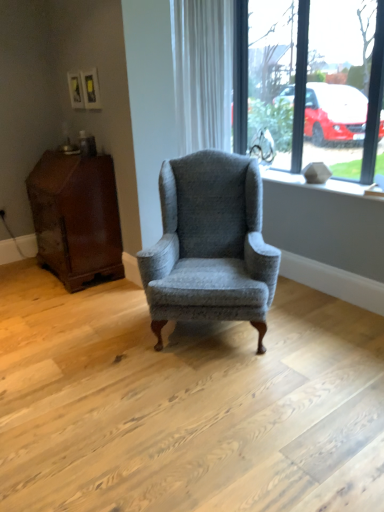
Question: Is clear glass window at upper right closer to the viewer compared to textured gray wingback chair at center?

Choices:
 (A) yes
 (B) no

Answer: (B)

Question: From the image's perspective, is clear glass window at upper right over textured gray wingback chair at center?

Choices:
 (A) yes
 (B) no

Answer: (A)

Question: From a real-world perspective, is clear glass window at upper right physically below textured gray wingback chair at center?

Choices:
 (A) yes
 (B) no

Answer: (B)

Question: Is clear glass window at upper right oriented towards textured gray wingback chair at center?

Choices:
 (A) no
 (B) yes

Answer: (B)

Question: Is clear glass window at upper right oriented away from textured gray wingback chair at center?

Choices:
 (A) no
 (B) yes

Answer: (A)

Question: In the image, is clear glass window at upper right on the left side or the right side of white textured curtain at upper center?

Choices:
 (A) right
 (B) left

Answer: (A)

Question: Considering the positions of clear glass window at upper right and white textured curtain at upper center in the image, is clear glass window at upper right bigger or smaller than white textured curtain at upper center?

Choices:
 (A) big
 (B) small

Answer: (A)

Question: Is clear glass window at upper right situated inside white textured curtain at upper center or outside?

Choices:
 (A) inside
 (B) outside

Answer: (B)

Question: In terms of height, does clear glass window at upper right look taller or shorter compared to white textured curtain at upper center?

Choices:
 (A) short
 (B) tall

Answer: (B)

Question: Is point (266, 169) closer or farther from the camera than point (221, 109)?

Choices:
 (A) farther
 (B) closer

Answer: (A)

Question: From the image's perspective, is white textured stone at upper right positioned above or below white textured curtain at upper center?

Choices:
 (A) above
 (B) below

Answer: (B)

Question: Is white textured stone at upper right inside or outside of white textured curtain at upper center?

Choices:
 (A) inside
 (B) outside

Answer: (B)

Question: Is white textured stone at upper right in front of or behind white textured curtain at upper center in the image?

Choices:
 (A) behind
 (B) front

Answer: (B)

Question: Is white textured curtain at upper center in front of or behind white textured stone at upper right in the image?

Choices:
 (A) front
 (B) behind

Answer: (B)

Question: In terms of height, does white textured curtain at upper center look taller or shorter compared to white textured stone at upper right?

Choices:
 (A) tall
 (B) short

Answer: (A)